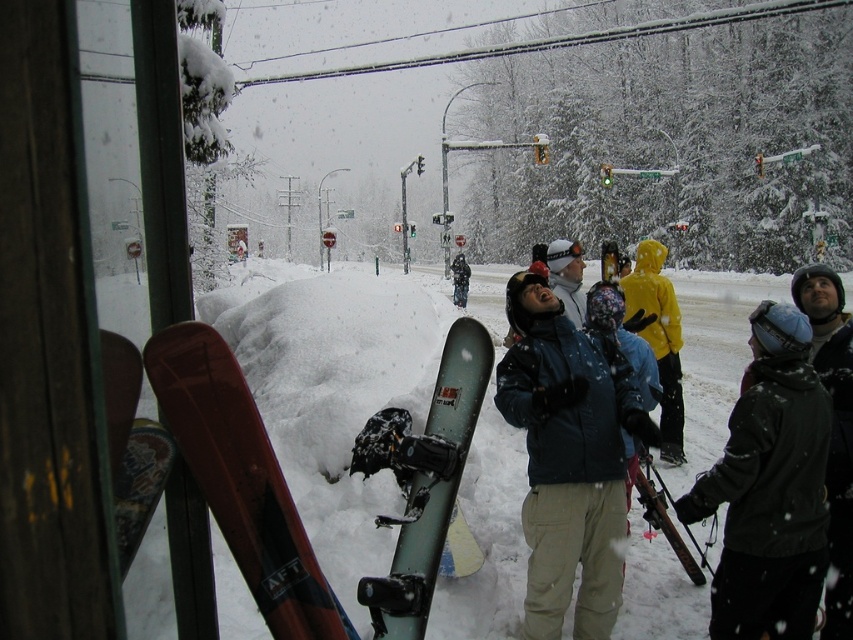
Which is more to the right, white fluffy snow at center or dark gray jacket at right?

From the viewer's perspective, white fluffy snow at center appears more on the right side.

At what (x,y) coordinates should I click in order to perform the action: click on white fluffy snow at center. Please return your answer as a coordinate pair (x, y). The image size is (853, 640). Looking at the image, I should click on (334, 387).

In order to click on white fluffy snow at center in this screenshot , I will do `click(334, 387)`.

Which is above, matte blue jacket at center or green matte snowboard at center?

green matte snowboard at center

Is matte blue jacket at center thinner than green matte snowboard at center?

No, matte blue jacket at center is not thinner than green matte snowboard at center.

You are a GUI agent. You are given a task and a screenshot of the screen. Output one action in this format:
    pyautogui.click(x=<x>, y=<y>)
    Task: Click on the matte blue jacket at center
    The image size is (853, 640).
    Given the screenshot: What is the action you would take?
    click(567, 458)

Find the location of a particular element. matte blue jacket at center is located at coordinates (567, 458).

Does green matte snowboard at center appear under matte black snowboard at center?

Correct, green matte snowboard at center is located below matte black snowboard at center.

Is green matte snowboard at center further to camera compared to matte black snowboard at center?

That is False.

Does point (456, 419) come closer to viewer compared to point (453, 291)?

That is True.

Image resolution: width=853 pixels, height=640 pixels. What are the coordinates of `green matte snowboard at center` in the screenshot? It's located at (430, 484).